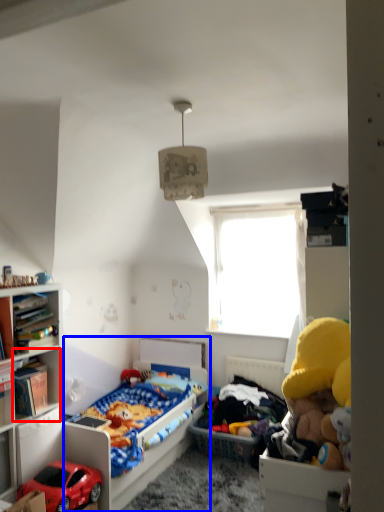
Question: Which object appears farthest to the camera in this image, cabinet (highlighted by a red box) or bed (highlighted by a blue box)?

Choices:
 (A) cabinet
 (B) bed

Answer: (B)